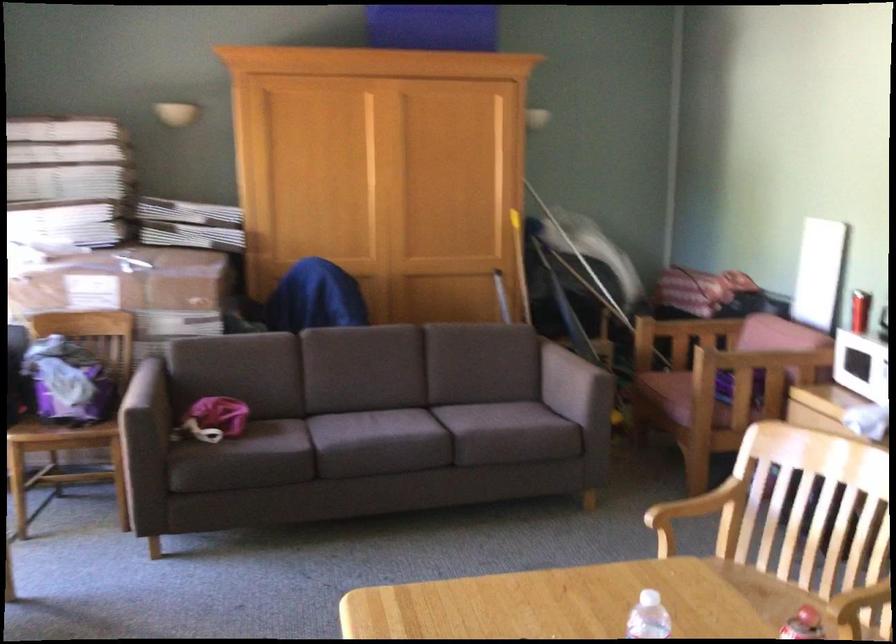
Find where to sit the brown sofa surface. Please return your answer as a coordinate pair (x, y).

(467, 430)